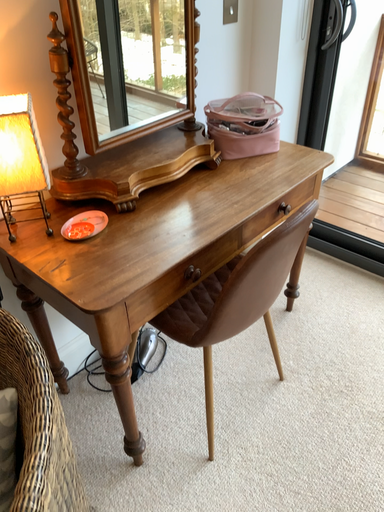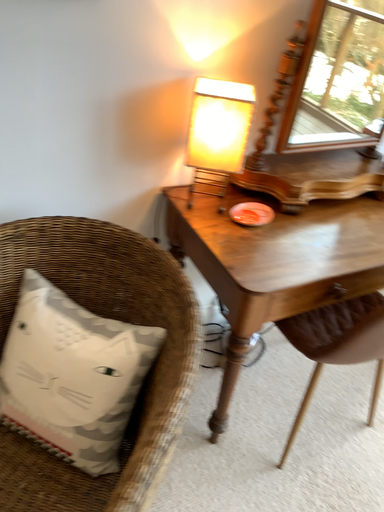
Question: Which way did the camera rotate in the video?

Choices:
 (A) rotated right
 (B) rotated left

Answer: (B)